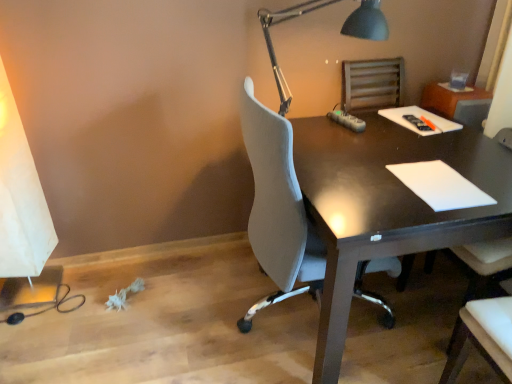
Question: Considering the relative positions of white matte notepad at right and dark wood desk at center in the image provided, is white matte notepad at right in front of dark wood desk at center?

Choices:
 (A) yes
 (B) no

Answer: (B)

Question: Is white matte notepad at right placed right next to dark wood desk at center?

Choices:
 (A) yes
 (B) no

Answer: (B)

Question: Is dark wood desk at center at the back of white matte notepad at right?

Choices:
 (A) yes
 (B) no

Answer: (A)

Question: Is white matte notepad at right to the right of dark wood desk at center from the viewer's perspective?

Choices:
 (A) yes
 (B) no

Answer: (A)

Question: Is dark wood desk at center inside white matte notepad at right?

Choices:
 (A) yes
 (B) no

Answer: (B)

Question: Visually, is metallic gray desk lamp at upper right positioned to the left or to the right of white matte notepad at right?

Choices:
 (A) left
 (B) right

Answer: (A)

Question: In terms of size, does metallic gray desk lamp at upper right appear bigger or smaller than white matte notepad at right?

Choices:
 (A) small
 (B) big

Answer: (B)

Question: From their relative heights in the image, would you say metallic gray desk lamp at upper right is taller or shorter than white matte notepad at right?

Choices:
 (A) tall
 (B) short

Answer: (A)

Question: From a real-world perspective, is metallic gray desk lamp at upper right above or below white matte notepad at right?

Choices:
 (A) above
 (B) below

Answer: (A)

Question: Is dark wood desk at center inside or outside of white matte notepad at right?

Choices:
 (A) outside
 (B) inside

Answer: (A)

Question: Considering the positions of dark wood desk at center and white matte notepad at right in the image, is dark wood desk at center wider or thinner than white matte notepad at right?

Choices:
 (A) wide
 (B) thin

Answer: (A)

Question: From the image's perspective, is dark wood desk at center located above or below white matte notepad at right?

Choices:
 (A) above
 (B) below

Answer: (B)

Question: Looking at the image, does dark wood desk at center seem bigger or smaller compared to white matte notepad at right?

Choices:
 (A) small
 (B) big

Answer: (B)

Question: In the image, is white matte notepad at right positioned in front of or behind dark wood desk at center?

Choices:
 (A) front
 (B) behind

Answer: (B)

Question: In terms of size, does white matte notepad at right appear bigger or smaller than dark wood desk at center?

Choices:
 (A) small
 (B) big

Answer: (A)